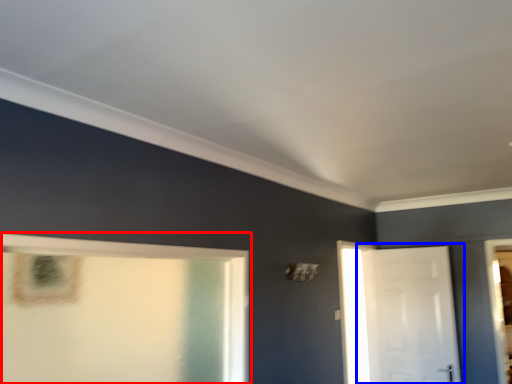
Question: Which point is further to the camera, window (highlighted by a red box) or door (highlighted by a blue box)?

Choices:
 (A) window
 (B) door

Answer: (B)